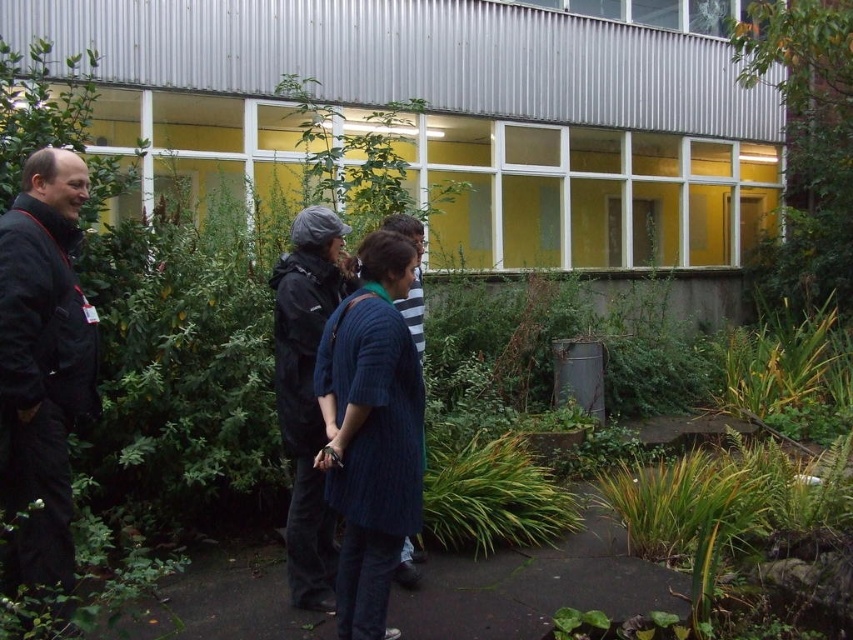
Question: Is cable-knit sweater at center smaller than dark gray hooded jacket at center?

Choices:
 (A) yes
 (B) no

Answer: (B)

Question: Which point is closer to the camera?

Choices:
 (A) (532, 472)
 (B) (64, 563)
 (C) (381, 440)
 (D) (289, 525)

Answer: (C)

Question: Which of the following is the closest to the observer?

Choices:
 (A) (77, 324)
 (B) (532, 525)
 (C) (415, 449)

Answer: (A)

Question: Is cable-knit sweater at center below green leafy plant at lower center?

Choices:
 (A) no
 (B) yes

Answer: (A)

Question: Can you confirm if black matte jacket at left is positioned to the right of green leafy plant at lower center?

Choices:
 (A) yes
 (B) no

Answer: (B)

Question: Among these objects, which one is nearest to the camera?

Choices:
 (A) black matte jacket at left
 (B) cable-knit sweater at center

Answer: (A)